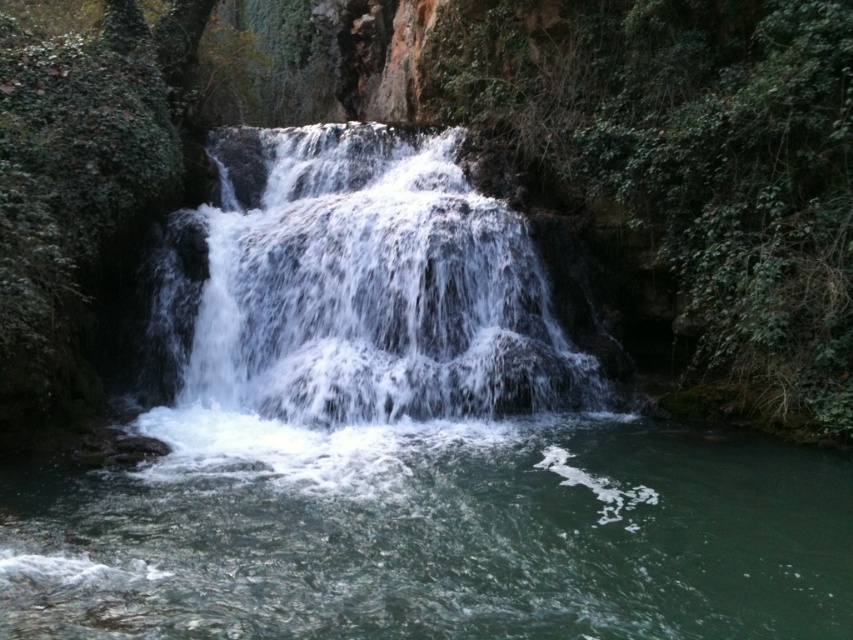
Question: From the image, what is the correct spatial relationship of clear water at center in relation to green leafy vegetation at center?

Choices:
 (A) below
 (B) above

Answer: (A)

Question: Does clear water at center lie in front of white frothy water at center?

Choices:
 (A) no
 (B) yes

Answer: (B)

Question: Which point is closer to the camera?

Choices:
 (A) (427, 515)
 (B) (436, 45)

Answer: (A)

Question: Is clear water at center wider than green leafy vegetation at center?

Choices:
 (A) no
 (B) yes

Answer: (B)

Question: Which point is farther from the camera taking this photo?

Choices:
 (A) [801, 323]
 (B) [230, 186]

Answer: (B)

Question: Which point appears farthest from the camera in this image?

Choices:
 (A) (750, 122)
 (B) (700, 452)
 (C) (381, 387)

Answer: (C)